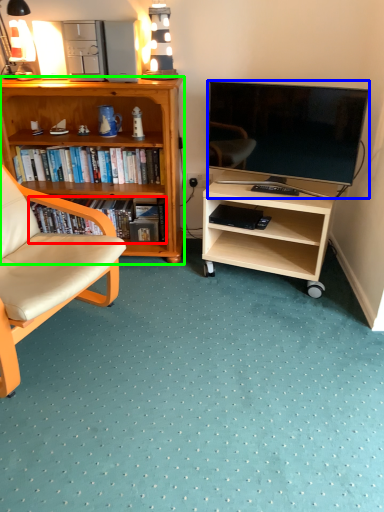
Question: Considering the real-world distances, which object is farthest from book (highlighted by a red box)? television (highlighted by a blue box) or desk (highlighted by a green box)?

Choices:
 (A) television
 (B) desk

Answer: (A)